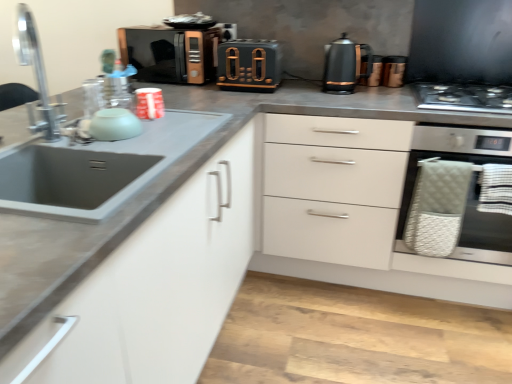
Question: Is metallic copper kettle at upper right, which ranks as the fourth appliance in front-to-back order, facing towards silver metallic faucet at left?

Choices:
 (A) yes
 (B) no

Answer: (B)

Question: Is metallic copper kettle at upper right, which is counted as the fifth appliance, starting from the left, shorter than silver metallic faucet at left?

Choices:
 (A) no
 (B) yes

Answer: (B)

Question: Is metallic copper kettle at upper right, which ranks as the fourth appliance in front-to-back order, not within silver metallic faucet at left?

Choices:
 (A) no
 (B) yes

Answer: (B)

Question: From a real-world perspective, is metallic copper kettle at upper right, placed as the first appliance when sorted from right to left, on silver metallic faucet at left?

Choices:
 (A) no
 (B) yes

Answer: (A)

Question: From a real-world perspective, does metallic copper kettle at upper right, which ranks as the fourth appliance in front-to-back order, sit lower than silver metallic faucet at left?

Choices:
 (A) yes
 (B) no

Answer: (A)

Question: Considering the relative sizes of metallic copper kettle at upper right, placed as the first appliance when sorted from right to left, and silver metallic faucet at left in the image provided, is metallic copper kettle at upper right, placed as the first appliance when sorted from right to left, smaller than silver metallic faucet at left?

Choices:
 (A) no
 (B) yes

Answer: (B)

Question: Is silver metallic faucet at left far away from metallic copper kettle at upper right, the second appliance from the back?

Choices:
 (A) yes
 (B) no

Answer: (A)

Question: Does silver metallic faucet at left turn towards metallic copper kettle at upper right, placed as the first appliance when sorted from right to left?

Choices:
 (A) no
 (B) yes

Answer: (A)

Question: Is silver metallic faucet at left taller than metallic copper kettle at upper right, placed as the first appliance when sorted from right to left?

Choices:
 (A) yes
 (B) no

Answer: (A)

Question: Is silver metallic faucet at left next to metallic copper kettle at upper right, placed as the first appliance when sorted from right to left, and touching it?

Choices:
 (A) no
 (B) yes

Answer: (A)

Question: From a real-world perspective, is silver metallic faucet at left positioned over metallic copper kettle at upper right, the second appliance from the back, based on gravity?

Choices:
 (A) yes
 (B) no

Answer: (A)

Question: Is silver metallic faucet at left to the left of metallic copper kettle at upper right, placed as the first appliance when sorted from right to left, from the viewer's perspective?

Choices:
 (A) yes
 (B) no

Answer: (A)

Question: Does matte black microwave at upper center, the fourth appliance positioned from the right, have a greater height compared to matte black toaster at center, which appears as the 4th appliance when viewed from the back?

Choices:
 (A) no
 (B) yes

Answer: (B)